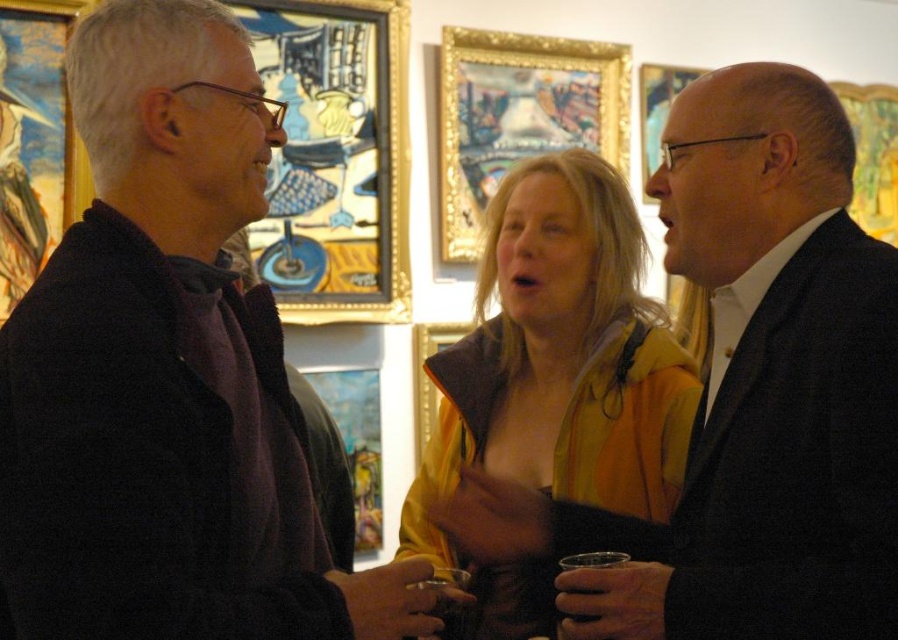
Is gold-framed painting at upper center to the right of transparent plastic cup at center from the viewer's perspective?

No, gold-framed painting at upper center is not to the right of transparent plastic cup at center.

Can you confirm if gold-framed painting at upper center is positioned above transparent plastic cup at center?

Yes, gold-framed painting at upper center is above transparent plastic cup at center.

Is point (313, 122) positioned in front of point (597, 563)?

No, it is not.

The height and width of the screenshot is (640, 898). What are the coordinates of `gold-framed painting at upper center` in the screenshot? It's located at (333, 157).

Can you confirm if gold-framed painting at upper center is positioned to the right of gold/gilded picture frame at upper right?

No, gold-framed painting at upper center is not to the right of gold/gilded picture frame at upper right.

What do you see at coordinates (333, 157) in the screenshot?
I see `gold-framed painting at upper center` at bounding box center [333, 157].

Is point (320, 83) closer to viewer compared to point (866, 108)?

Yes, point (320, 83) is closer to viewer.

Locate an element on the screen. This screenshot has height=640, width=898. gold-framed painting at upper center is located at coordinates coord(333,157).

Does point (98, 195) lie in front of point (650, 172)?

Yes, it is in front of point (650, 172).

Is dark woolen sweater at left positioned at the back of metallic gold picture frame at upper center?

No, dark woolen sweater at left is in front of metallic gold picture frame at upper center.

Does point (43, 564) come in front of point (641, 92)?

Yes.

You are a GUI agent. You are given a task and a screenshot of the screen. Output one action in this format:
    pyautogui.click(x=<x>, y=<y>)
    Task: Click on the dark woolen sweater at left
    Image resolution: width=898 pixels, height=640 pixels.
    Given the screenshot: What is the action you would take?
    pyautogui.click(x=166, y=374)